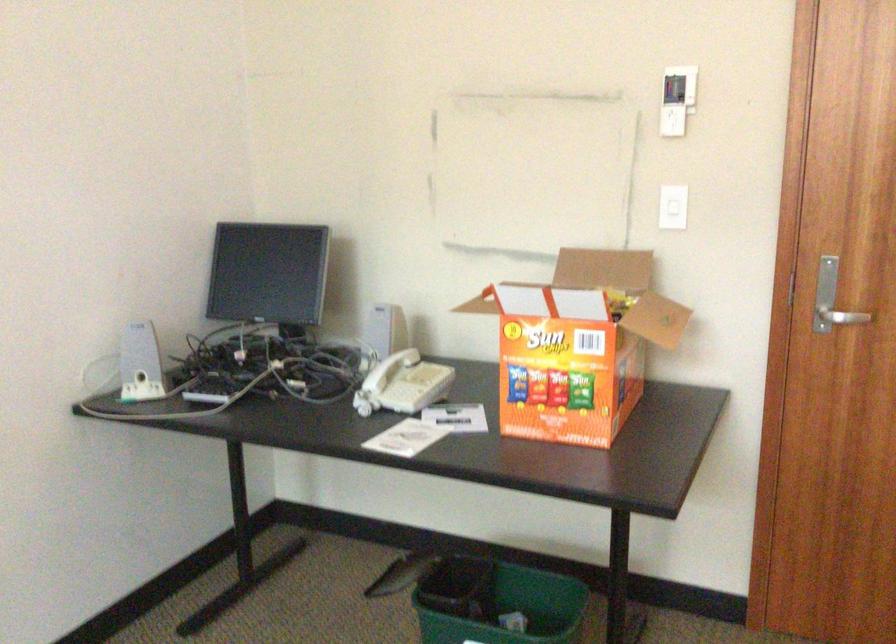
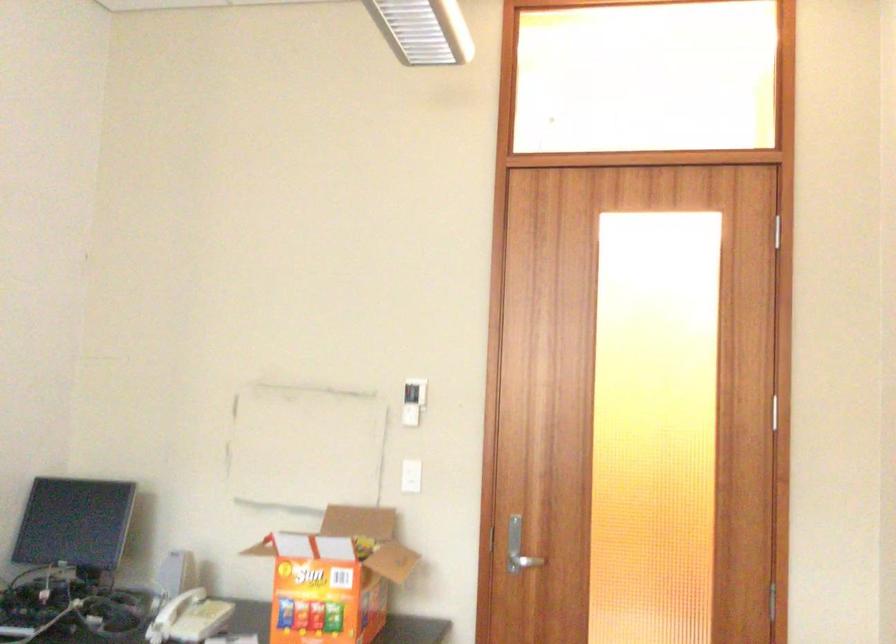
Locate, in the second image, the point that corresponds to (383,391) in the first image.

(170, 617)